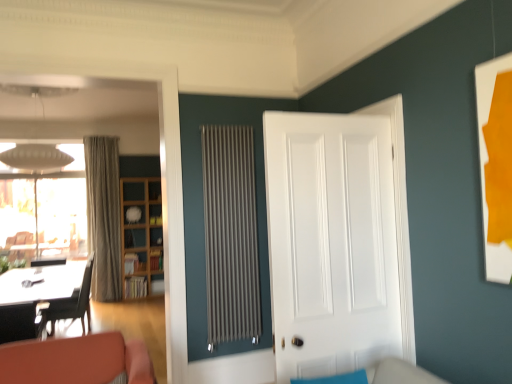
Question: Does teal fabric couch at lower center lie in front of white glossy picture frame at right?

Choices:
 (A) yes
 (B) no

Answer: (A)

Question: From the image's perspective, is teal fabric couch at lower center over white glossy picture frame at right?

Choices:
 (A) no
 (B) yes

Answer: (A)

Question: Can you confirm if teal fabric couch at lower center is smaller than white glossy picture frame at right?

Choices:
 (A) yes
 (B) no

Answer: (B)

Question: Is teal fabric couch at lower center aimed at white glossy picture frame at right?

Choices:
 (A) no
 (B) yes

Answer: (A)

Question: Is teal fabric couch at lower center to the right of white glossy picture frame at right from the viewer's perspective?

Choices:
 (A) yes
 (B) no

Answer: (B)

Question: Can we say teal fabric couch at lower center lies outside white glossy picture frame at right?

Choices:
 (A) yes
 (B) no

Answer: (A)

Question: From a real-world perspective, is white glossy picture frame at right positioned over transparent glass window at upper left based on gravity?

Choices:
 (A) no
 (B) yes

Answer: (B)

Question: Can you confirm if white glossy picture frame at right is thinner than transparent glass window at upper left?

Choices:
 (A) yes
 (B) no

Answer: (A)

Question: Is white glossy picture frame at right smaller than transparent glass window at upper left?

Choices:
 (A) no
 (B) yes

Answer: (B)

Question: Is white glossy picture frame at right further to camera compared to transparent glass window at upper left?

Choices:
 (A) yes
 (B) no

Answer: (B)

Question: Does white glossy picture frame at right have a greater width compared to transparent glass window at upper left?

Choices:
 (A) no
 (B) yes

Answer: (A)

Question: Can you confirm if white glossy picture frame at right is bigger than transparent glass window at upper left?

Choices:
 (A) no
 (B) yes

Answer: (A)

Question: Can you confirm if black leather chair at left is positioned to the left of beige textured curtain at left?

Choices:
 (A) yes
 (B) no

Answer: (B)